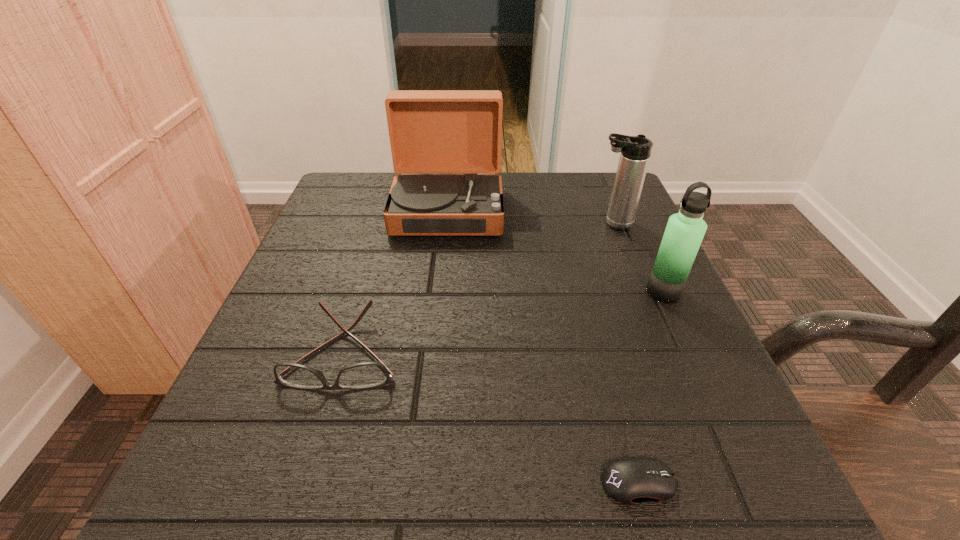
This screenshot has width=960, height=540. I want to click on vacant space that is in between the computer equipment and the phonograph record, so click(x=543, y=347).

The image size is (960, 540). In order to click on free space between the second nearest object and the phonograph record in this screenshot , I will do `click(396, 281)`.

Identify the location of empty location between the phonograph record and the fourth farthest object. This screenshot has height=540, width=960. (396, 281).

The image size is (960, 540). Find the location of `free space between the phonograph record and the third nearest object`. free space between the phonograph record and the third nearest object is located at coordinates (556, 251).

At what (x,y) coordinates should I click in order to perform the action: click on blank region between the farther thermos bottle and the nearest object. Please return your answer as a coordinate pair (x, y). The height and width of the screenshot is (540, 960). Looking at the image, I should click on (626, 353).

Where is `vacant point located between the third object from left to right and the farther thermos bottle`? Image resolution: width=960 pixels, height=540 pixels. vacant point located between the third object from left to right and the farther thermos bottle is located at coordinates (626, 353).

You are a GUI agent. You are given a task and a screenshot of the screen. Output one action in this format:
    pyautogui.click(x=<x>, y=<y>)
    Task: Click on the unoccupied position between the third object from left to right and the third nearest object
    The height and width of the screenshot is (540, 960).
    Given the screenshot: What is the action you would take?
    pyautogui.click(x=651, y=387)

Locate an element on the screen. unoccupied area between the farther thermos bottle and the third object from right to left is located at coordinates (626, 353).

You are a GUI agent. You are given a task and a screenshot of the screen. Output one action in this format:
    pyautogui.click(x=<x>, y=<y>)
    Task: Click on the vacant space that's between the farther thermos bottle and the phonograph record
    
    Given the screenshot: What is the action you would take?
    pyautogui.click(x=530, y=217)

Locate an element on the screen. the fourth closest object to the computer equipment is located at coordinates tap(635, 151).